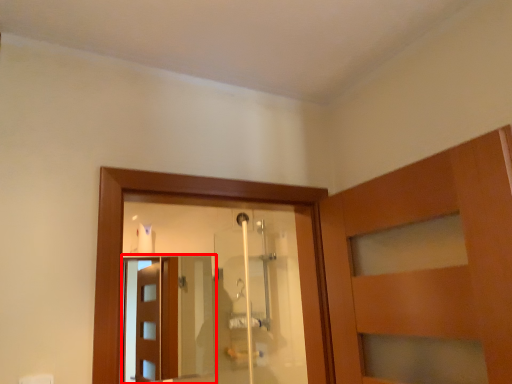
Question: From the image's perspective, what is the correct spatial relationship of screen door (annotated by the red box) in relation to shower door?

Choices:
 (A) below
 (B) above

Answer: (A)